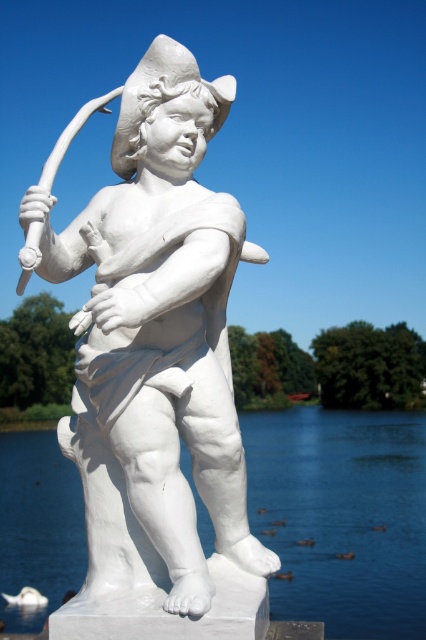
Is point (221, 116) positioned before point (247, 470)?

Yes.

Does white marble statue at center appear on the left side of transparent water at statue right?

Correct, you'll find white marble statue at center to the left of transparent water at statue right.

This screenshot has width=426, height=640. Identify the location of white marble statue at center. (158, 344).